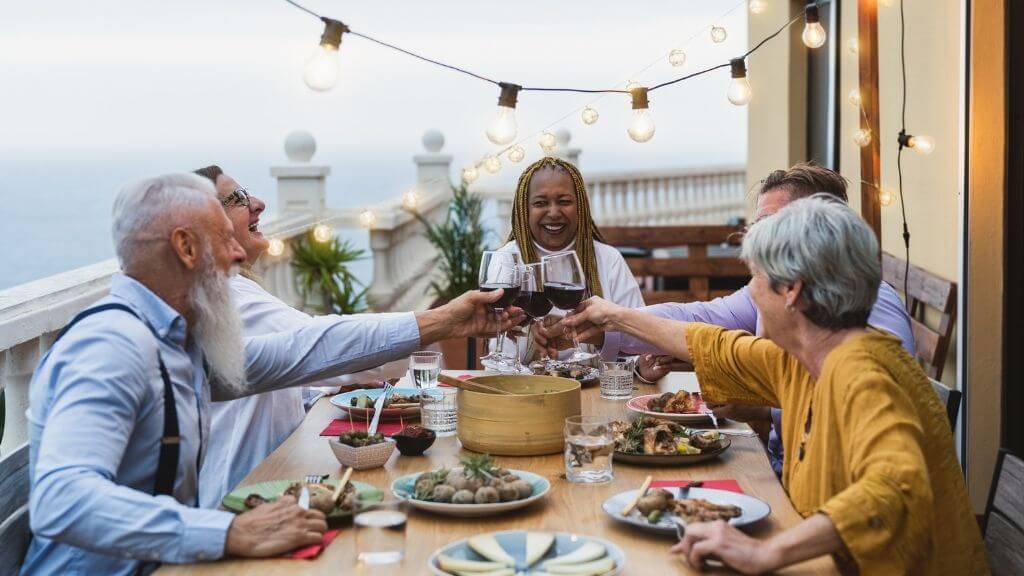
This screenshot has width=1024, height=576. What are the coordinates of `8 plates on the table` in the screenshot? It's located at (541, 552), (687, 514), (681, 430), (678, 386), (456, 484), (332, 491), (387, 388), (571, 365).